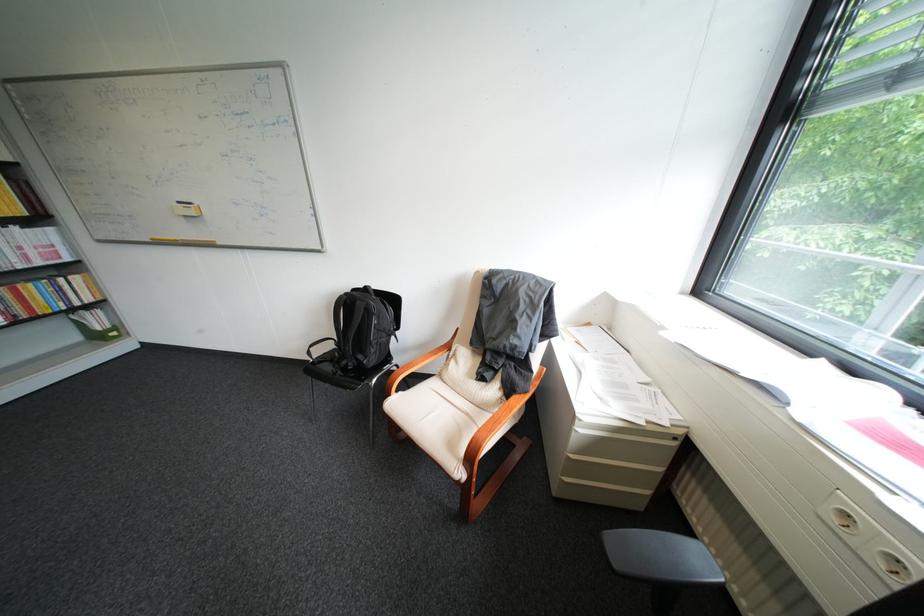
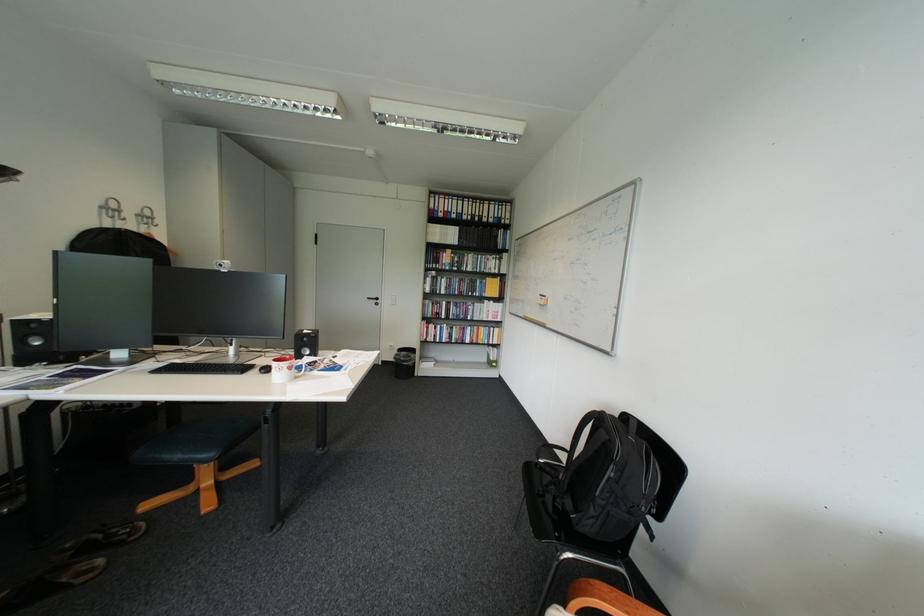
Question: The camera is either moving clockwise (left) or counter-clockwise (right) around the object. The first image is from the beginning of the video and the second image is from the end. Is the camera moving left or right when shooting the video?

Choices:
 (A) Left
 (B) Right

Answer: (B)